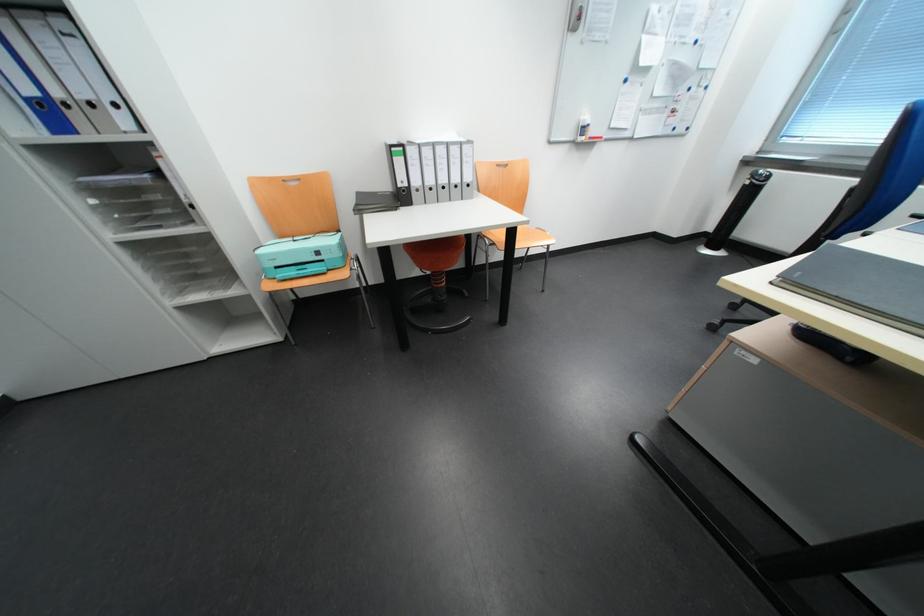
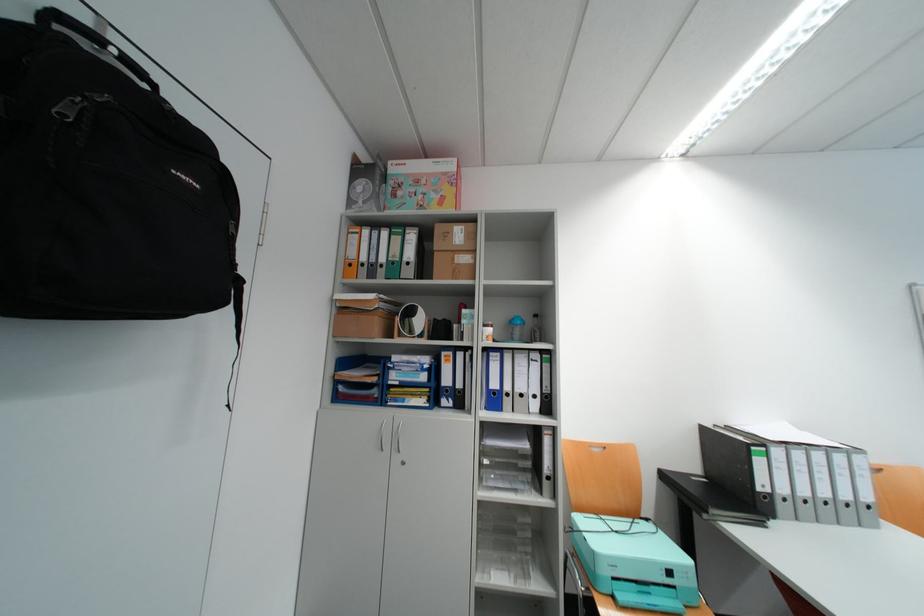
Where in the second image is the point corresponding to point (330, 254) from the first image?

(682, 573)